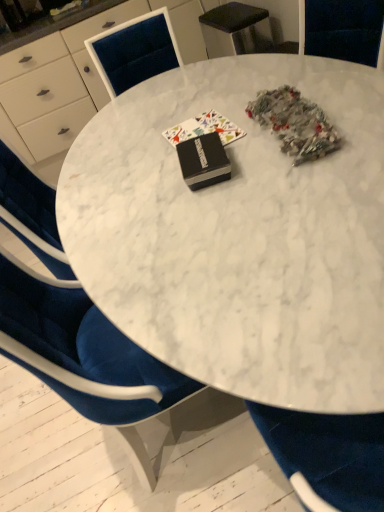
Image resolution: width=384 pixels, height=512 pixels. What are the coordinates of `vacant area that lies between black matte book at center, which ranks as the second book in back-to-front order, and black matte book at center, which appears as the first book when viewed from the back` in the screenshot? It's located at (223, 146).